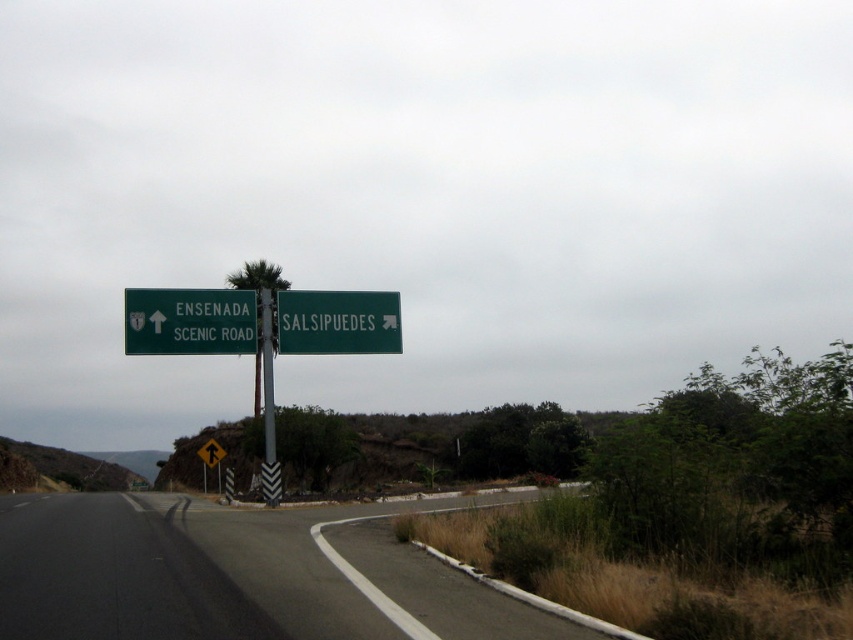
Does point (242, 301) come closer to viewer compared to point (260, 314)?

That is True.

Measure the distance between green matte sign at upper left and metallic pole at center.

green matte sign at upper left and metallic pole at center are 4.08 meters apart.

Locate an element on the screen. This screenshot has width=853, height=640. green matte sign at upper left is located at coordinates (189, 321).

You are a GUI agent. You are given a task and a screenshot of the screen. Output one action in this format:
    pyautogui.click(x=<x>, y=<y>)
    Task: Click on the green matte sign at upper left
    The height and width of the screenshot is (640, 853).
    Given the screenshot: What is the action you would take?
    pyautogui.click(x=189, y=321)

The height and width of the screenshot is (640, 853). What do you see at coordinates (241, 573) in the screenshot? I see `black asphalt road at center` at bounding box center [241, 573].

Which of these two, black asphalt road at center or yellow reflective plastic pedestrian crossing sign at upper center, stands shorter?

yellow reflective plastic pedestrian crossing sign at upper center

Image resolution: width=853 pixels, height=640 pixels. What are the coordinates of `black asphalt road at center` in the screenshot? It's located at (241, 573).

Where is `black asphalt road at center`? The image size is (853, 640). black asphalt road at center is located at coordinates (241, 573).

Can you confirm if green matte sign at upper left is positioned below yellow reflective plastic pedestrian crossing sign at upper center?

Incorrect, green matte sign at upper left is not positioned below yellow reflective plastic pedestrian crossing sign at upper center.

Does green matte sign at upper left come behind yellow reflective plastic pedestrian crossing sign at upper center?

That is False.

The height and width of the screenshot is (640, 853). What do you see at coordinates (189, 321) in the screenshot?
I see `green matte sign at upper left` at bounding box center [189, 321].

Image resolution: width=853 pixels, height=640 pixels. In order to click on green matte sign at upper left in this screenshot , I will do `click(189, 321)`.